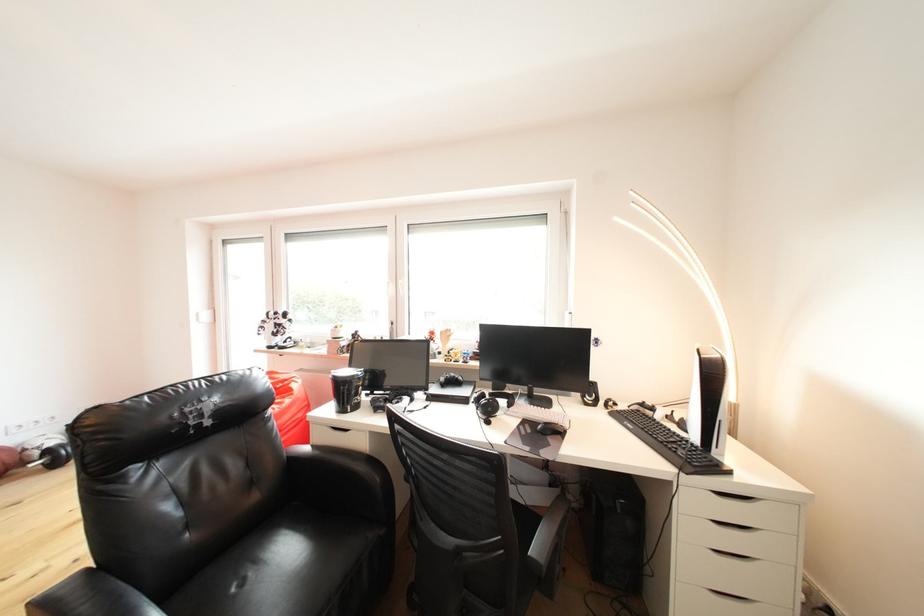
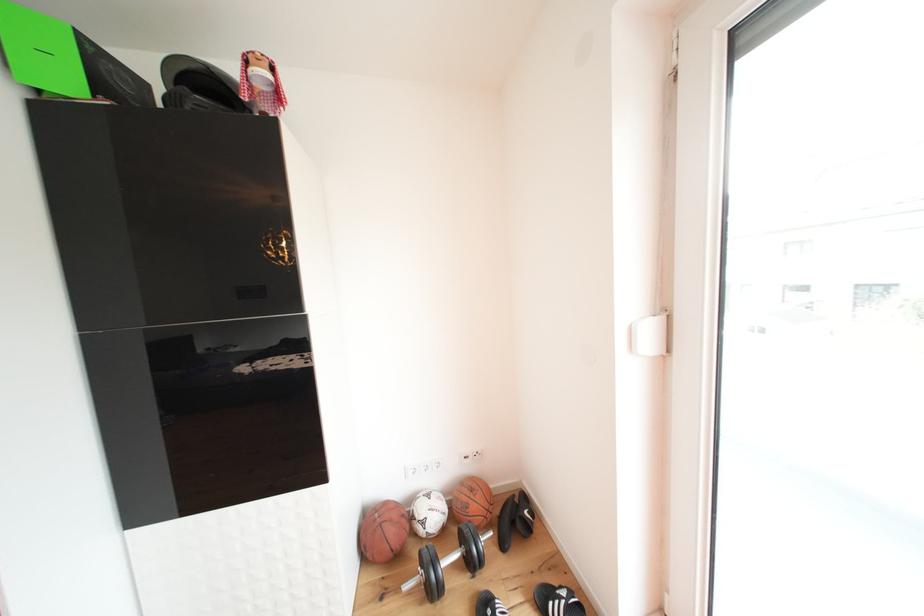
Locate, in the second image, the point that corresponds to pixel 32 455 in the first image.

(420, 523)